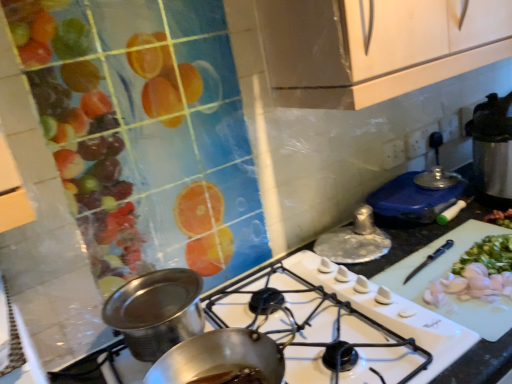
Question: Considering the relative positions of white glossy gas stove at center and white plastic cutting board at center-right in the image provided, is white glossy gas stove at center to the left of white plastic cutting board at center-right from the viewer's perspective?

Choices:
 (A) yes
 (B) no

Answer: (A)

Question: Is white glossy gas stove at center not inside white plastic cutting board at center-right?

Choices:
 (A) no
 (B) yes

Answer: (B)

Question: Is there a large distance between white glossy gas stove at center and white plastic cutting board at center-right?

Choices:
 (A) no
 (B) yes

Answer: (A)

Question: Is white glossy gas stove at center smaller than white plastic cutting board at center-right?

Choices:
 (A) no
 (B) yes

Answer: (A)

Question: Does white glossy gas stove at center lie in front of white plastic cutting board at center-right?

Choices:
 (A) no
 (B) yes

Answer: (B)

Question: Is white glossy gas stove at center oriented away from white plastic cutting board at center-right?

Choices:
 (A) no
 (B) yes

Answer: (A)

Question: Is the depth of shiny metallic pot at center, marked as the third kitchen appliance in a top-to-bottom arrangement, greater than that of white glossy gas stove at center?

Choices:
 (A) no
 (B) yes

Answer: (B)

Question: Is shiny metallic pot at center, arranged as the first kitchen appliance when ordered from the bottom, directly adjacent to white glossy gas stove at center?

Choices:
 (A) yes
 (B) no

Answer: (B)

Question: Does shiny metallic pot at center, which is the 1th kitchen appliance from front to back, have a larger size compared to white glossy gas stove at center?

Choices:
 (A) no
 (B) yes

Answer: (A)

Question: Is shiny metallic pot at center, the third kitchen appliance viewed from the back, looking in the opposite direction of white glossy gas stove at center?

Choices:
 (A) no
 (B) yes

Answer: (A)

Question: Does shiny metallic pot at center, marked as the third kitchen appliance in a top-to-bottom arrangement, lie in front of white glossy gas stove at center?

Choices:
 (A) yes
 (B) no

Answer: (B)

Question: From a real-world perspective, does shiny metallic pot at center, which is the 1th kitchen appliance from front to back, sit lower than white glossy gas stove at center?

Choices:
 (A) no
 (B) yes

Answer: (A)

Question: Could you tell me if white plastic cutting board at center-right is facing shiny metallic pot at center, which is the 1th kitchen appliance from front to back?

Choices:
 (A) yes
 (B) no

Answer: (B)